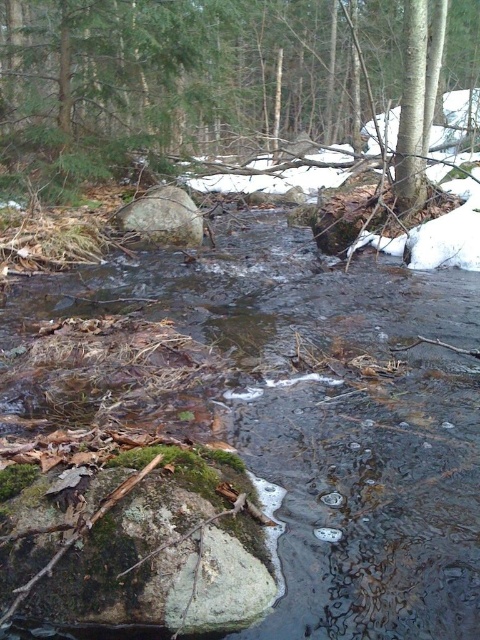
Who is more forward, (435, 273) or (268, 106)?

Point (435, 273) is more forward.

Can you confirm if clear water stream at center is wider than green mossy rock at center?

In fact, clear water stream at center might be narrower than green mossy rock at center.

Does point (436, 605) lie behind point (59, 173)?

No, (436, 605) is closer to viewer.

Image resolution: width=480 pixels, height=640 pixels. I want to click on clear water stream at center, so click(x=324, y=416).

Is green mossy rock at center to the right of gray rough boulder at center from the viewer's perspective?

Indeed, green mossy rock at center is positioned on the right side of gray rough boulder at center.

Describe the element at coordinates (167, 83) in the screenshot. The image size is (480, 640). I see `green mossy rock at center` at that location.

Image resolution: width=480 pixels, height=640 pixels. Describe the element at coordinates (167, 83) in the screenshot. I see `green mossy rock at center` at that location.

Find the location of `green mossy rock at center`. green mossy rock at center is located at coordinates (167, 83).

Which is below, clear water stream at center or gray rough boulder at center?

clear water stream at center

Which is above, clear water stream at center or gray rough boulder at center?

gray rough boulder at center

Is point (283, 401) farther from viewer compared to point (151, 237)?

No, (283, 401) is closer to viewer.

The height and width of the screenshot is (640, 480). Find the location of `clear water stream at center`. clear water stream at center is located at coordinates (324, 416).